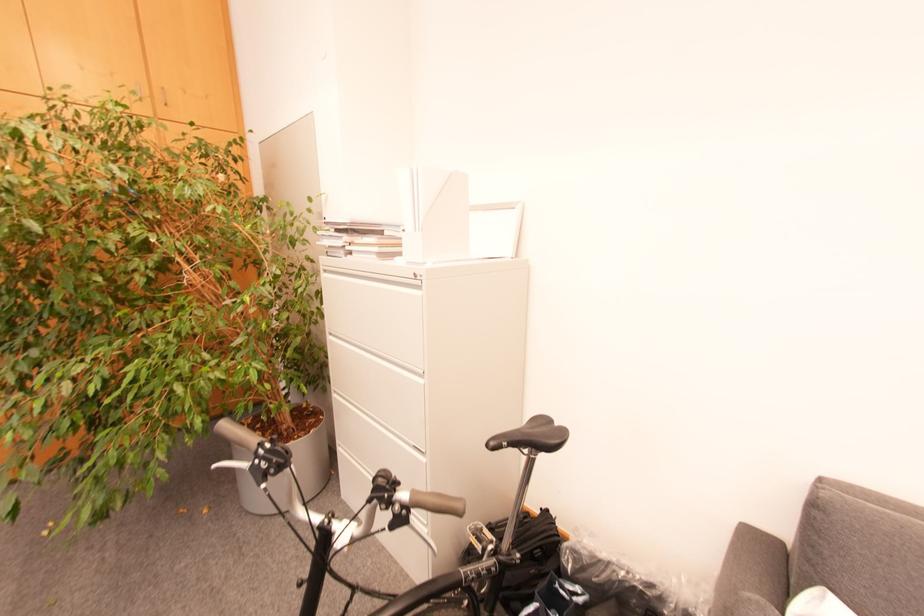
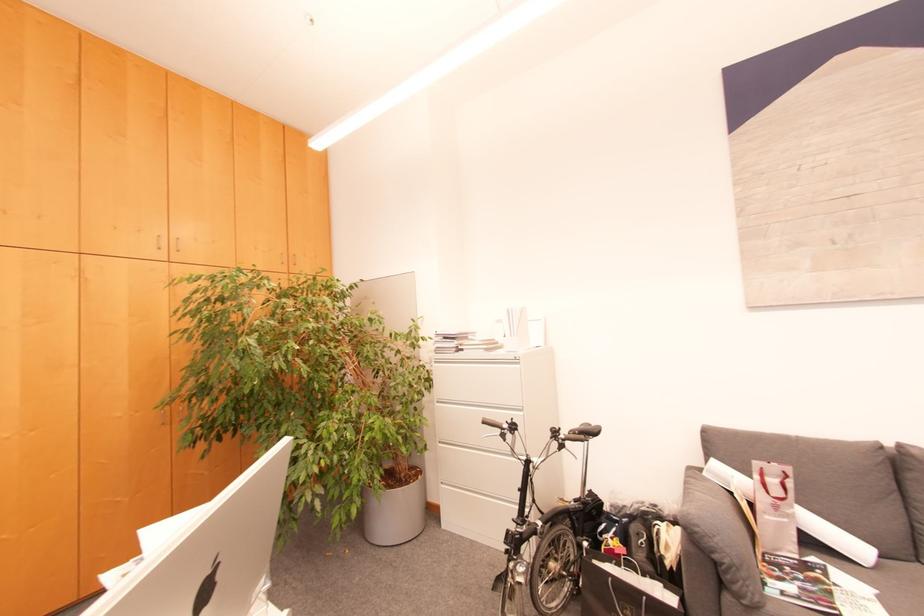
In a continuous first-person perspective shot, in which direction is the camera moving?

The movement direction of the cameraman is left, backward.